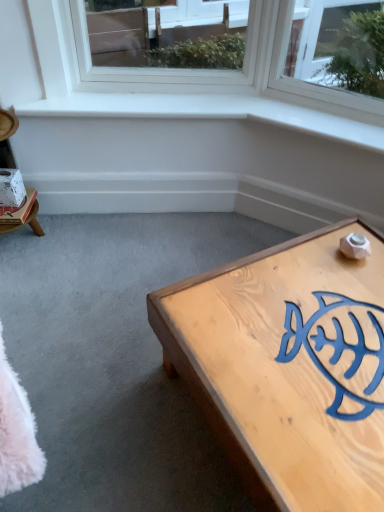
Question: Is light wood coffee table at lower right oriented away from white paper at left?

Choices:
 (A) no
 (B) yes

Answer: (A)

Question: Does light wood coffee table at lower right contain white paper at left?

Choices:
 (A) no
 (B) yes

Answer: (A)

Question: Is light wood coffee table at lower right facing towards white paper at left?

Choices:
 (A) yes
 (B) no

Answer: (B)

Question: Can you confirm if light wood coffee table at lower right is taller than white paper at left?

Choices:
 (A) no
 (B) yes

Answer: (B)

Question: Is the depth of light wood coffee table at lower right greater than that of white paper at left?

Choices:
 (A) no
 (B) yes

Answer: (A)

Question: Is light wood coffee table at lower right wider than white paper at left?

Choices:
 (A) no
 (B) yes

Answer: (B)

Question: Is light wood coffee table at lower right positioned far away from white cardboard box at left?

Choices:
 (A) yes
 (B) no

Answer: (A)

Question: From the image's perspective, does light wood coffee table at lower right appear lower than white cardboard box at left?

Choices:
 (A) yes
 (B) no

Answer: (A)

Question: Does light wood coffee table at lower right have a smaller size compared to white cardboard box at left?

Choices:
 (A) no
 (B) yes

Answer: (A)

Question: Can you confirm if light wood coffee table at lower right is thinner than white cardboard box at left?

Choices:
 (A) yes
 (B) no

Answer: (B)

Question: Is light wood coffee table at lower right aimed at white cardboard box at left?

Choices:
 (A) no
 (B) yes

Answer: (A)

Question: Can you confirm if light wood coffee table at lower right is positioned to the left of white cardboard box at left?

Choices:
 (A) yes
 (B) no

Answer: (B)

Question: Is white paper at left wider than light wood coffee table at lower right?

Choices:
 (A) no
 (B) yes

Answer: (A)